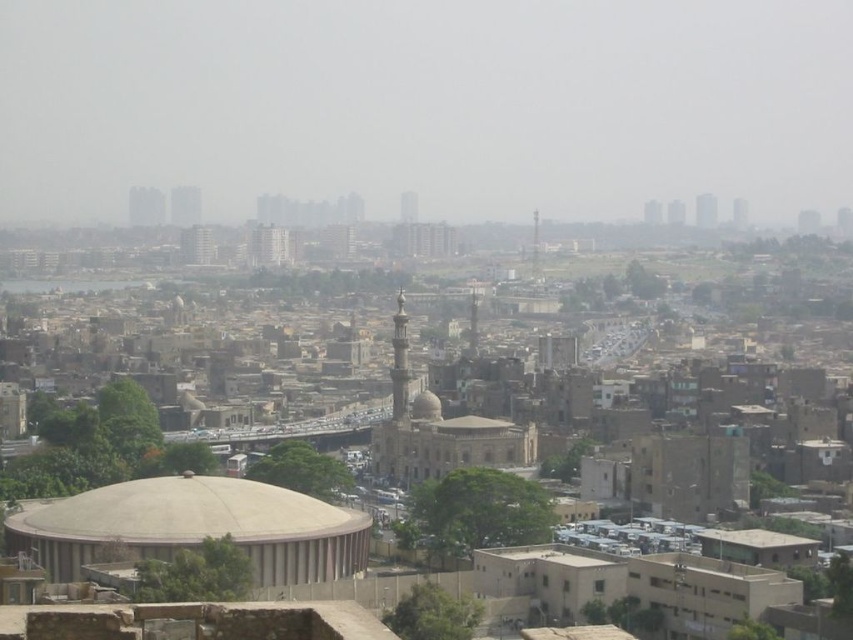
You are an urban planner analyzing the cityscape. The transparent foggy skyline at upper center and the beige concrete dome at center are both visible in the scene. Which of these two elements occupies a more prominent visual space in the image?

The transparent foggy skyline at upper center has a larger size compared to the beige concrete dome at center, making it occupy a more prominent visual space in the image.

You are an architect analyzing the central area of the image. You observe the beige concrete dome at center and the light beige stone dome at center. Which of these two domes is located to the left in the image?

The beige concrete dome at center is positioned on the left side of the light beige stone dome at center, so it is the one located to the left.

You are standing at the point with coordinates 0.725, 0.227 in the image. Which direction should you move to reach the beige concrete dome at center?

You should move to the east to reach the beige concrete dome at center because it is located at point (193, 528), which is east of your current position at (193, 464).